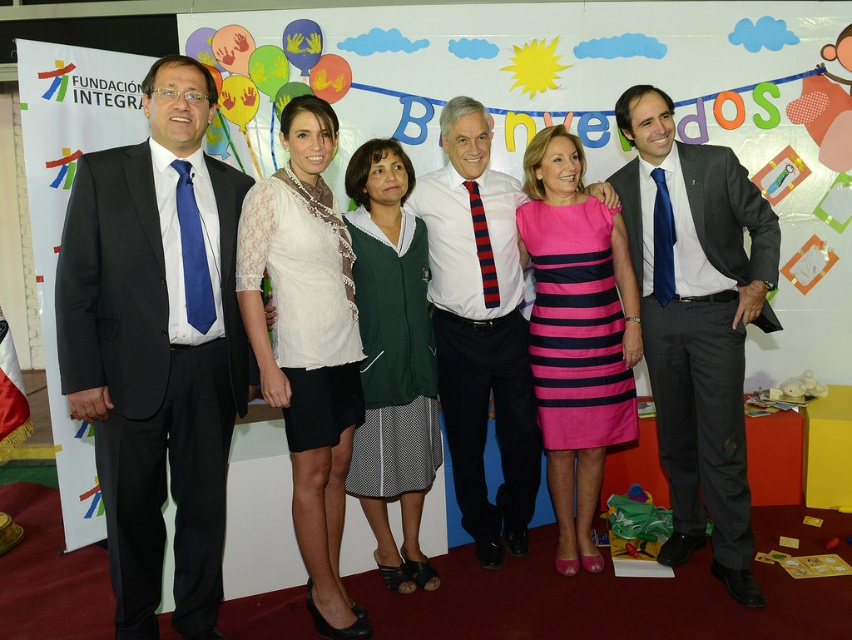
Question: Which of the following is the farthest from the observer?

Choices:
 (A) white shirt at center
 (B) dark gray suit at right
 (C) white lace blouse at center
 (D) white lace top at center

Answer: (A)

Question: Observing the image, what is the correct spatial positioning of pink striped dress at center in reference to white lace top at center?

Choices:
 (A) above
 (B) below

Answer: (A)

Question: Does black suit at left have a larger size compared to pink striped dress at center?

Choices:
 (A) yes
 (B) no

Answer: (A)

Question: Does black suit at left have a larger size compared to dark gray suit at right?

Choices:
 (A) no
 (B) yes

Answer: (A)

Question: Which of the following is the closest to the observer?

Choices:
 (A) pink striped dress at center
 (B) black suit at left
 (C) dark gray suit at right
 (D) white lace top at center

Answer: (B)

Question: Based on their relative distances, which object is farther from the white lace top at center?

Choices:
 (A) dark gray suit at right
 (B) white shirt at center

Answer: (A)